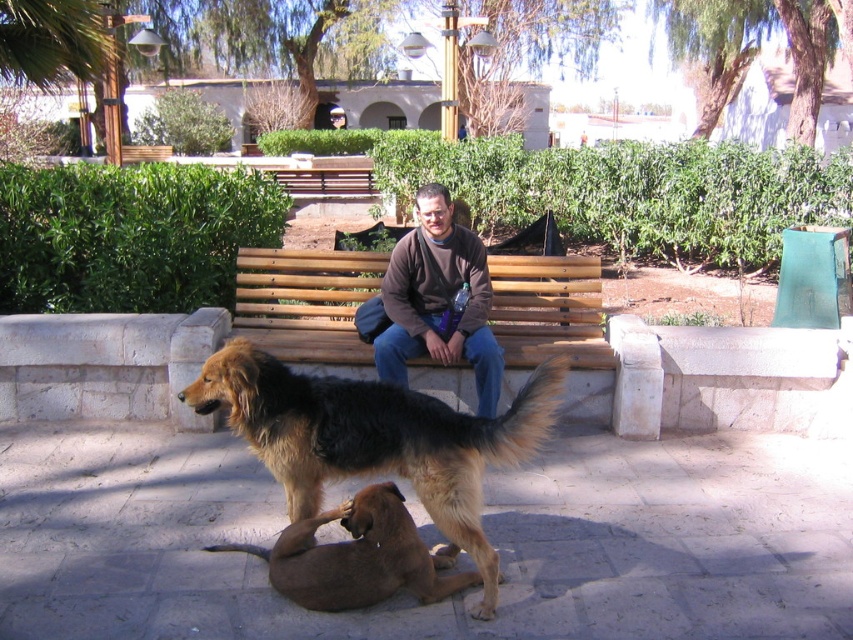
In the scene shown: Is brown soft sweater at center closer to camera compared to brown fur dog at lower center?

No, it is behind brown fur dog at lower center.

I want to click on brown soft sweater at center, so click(x=439, y=300).

Can you confirm if wooden bench at center is shorter than brown soft sweater at center?

Yes.

Can you confirm if wooden bench at center is taller than brown soft sweater at center?

In fact, wooden bench at center may be shorter than brown soft sweater at center.

Locate an element on the screen. The height and width of the screenshot is (640, 853). wooden bench at center is located at coordinates (554, 326).

Where is `wooden bench at center`? This screenshot has height=640, width=853. wooden bench at center is located at coordinates (554, 326).

Can you confirm if brown soft sweater at center is taller than brown cotton shirt at center?

Yes.

Is point (498, 396) positioned after point (335, 115)?

No, (498, 396) is closer to viewer.

Who is more distant from viewer, [486,355] or [335,106]?

The point [335,106] is behind.

Locate an element on the screen. brown soft sweater at center is located at coordinates [x=439, y=300].